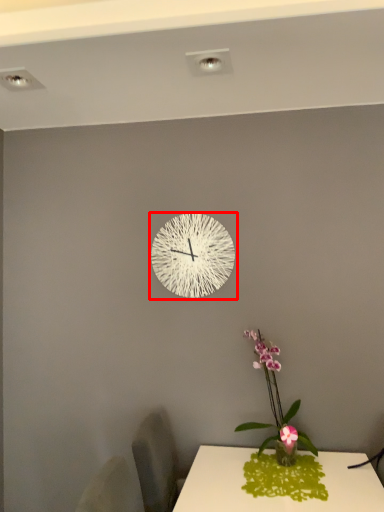
Question: From the image's perspective, what is the correct spatial positioning of wall clock (annotated by the red box) in reference to houseplant?

Choices:
 (A) above
 (B) below

Answer: (A)